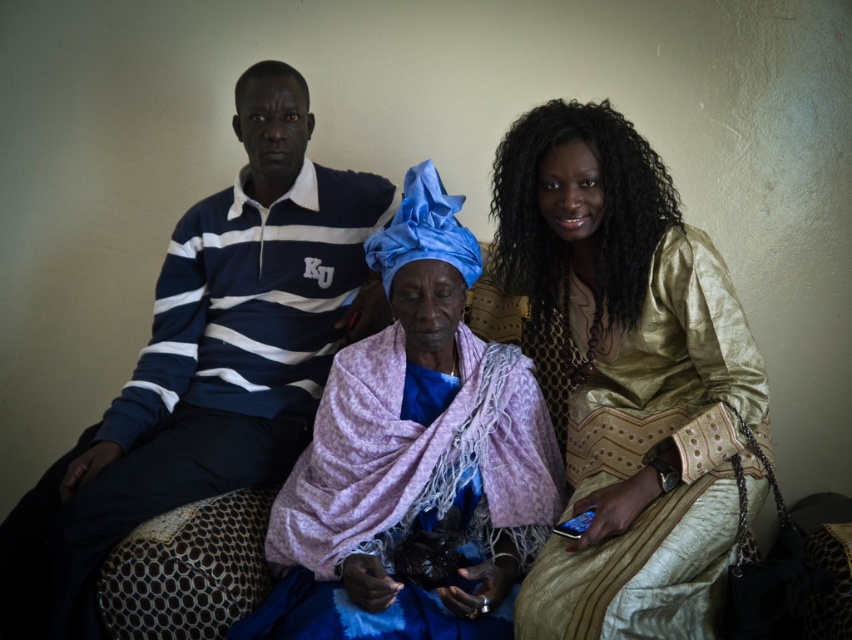
Question: Can you confirm if gold metallic dress at center is wider than matte blue and white striped polo shirt at left?

Choices:
 (A) yes
 (B) no

Answer: (B)

Question: Which object appears closest to the camera in this image?

Choices:
 (A) purple fabric at center
 (B) gold metallic dress at center
 (C) matte blue and white striped polo shirt at left

Answer: (B)

Question: Is gold metallic dress at center to the right of matte blue and white striped polo shirt at left from the viewer's perspective?

Choices:
 (A) yes
 (B) no

Answer: (A)

Question: Can you confirm if gold metallic dress at center is positioned to the left of purple fabric at center?

Choices:
 (A) no
 (B) yes

Answer: (A)

Question: Which point appears closest to the camera in this image?

Choices:
 (A) (543, 419)
 (B) (182, 435)

Answer: (B)

Question: Which object is positioned farthest from the matte blue and white striped polo shirt at left?

Choices:
 (A) gold metallic dress at center
 (B) purple fabric at center

Answer: (A)